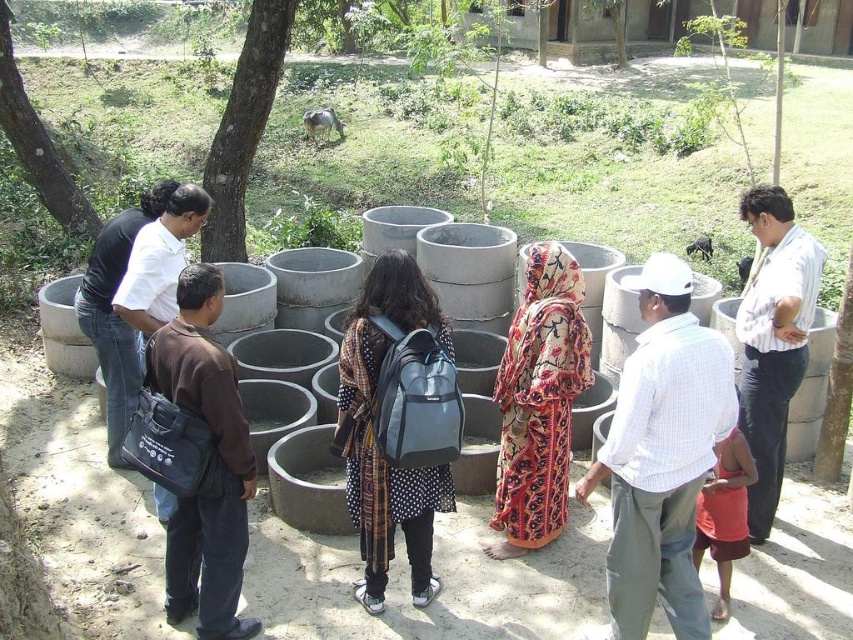
Who is higher up, polka dot fabric dress at center or green leafy tree at upper left?

green leafy tree at upper left is higher up.

The height and width of the screenshot is (640, 853). What do you see at coordinates (372, 435) in the screenshot?
I see `polka dot fabric dress at center` at bounding box center [372, 435].

Is point (421, 582) more distant than point (64, 193)?

No.

This screenshot has width=853, height=640. What are the coordinates of `polka dot fabric dress at center` in the screenshot? It's located at (372, 435).

Who is more distant from viewer, (216,136) or (16,102)?

The point (16,102) is behind.

Is green rough bark tree at upper center wider than green leafy tree at upper left?

No.

Image resolution: width=853 pixels, height=640 pixels. I want to click on green rough bark tree at upper center, so click(x=242, y=128).

Is printed fabric dress at center closer to the viewer compared to polka dot fabric dress at center?

No, it is not.

Is point (521, 465) more distant than point (405, 472)?

Yes, point (521, 465) is behind point (405, 472).

The image size is (853, 640). In order to click on printed fabric dress at center in this screenshot , I will do `click(538, 401)`.